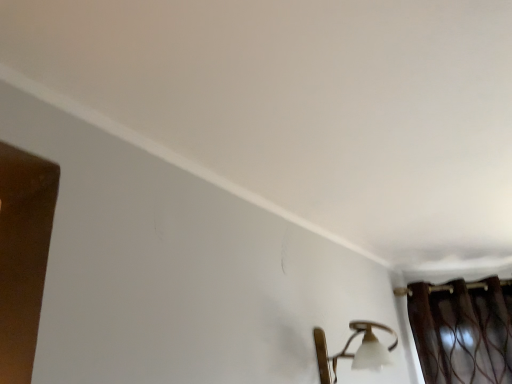
This screenshot has height=384, width=512. In order to click on matte gold wall sconce at lower right in this screenshot , I will do `click(357, 350)`.

Describe the element at coordinates (357, 350) in the screenshot. I see `matte gold wall sconce at lower right` at that location.

The image size is (512, 384). In order to click on matte gold wall sconce at lower right in this screenshot , I will do `click(357, 350)`.